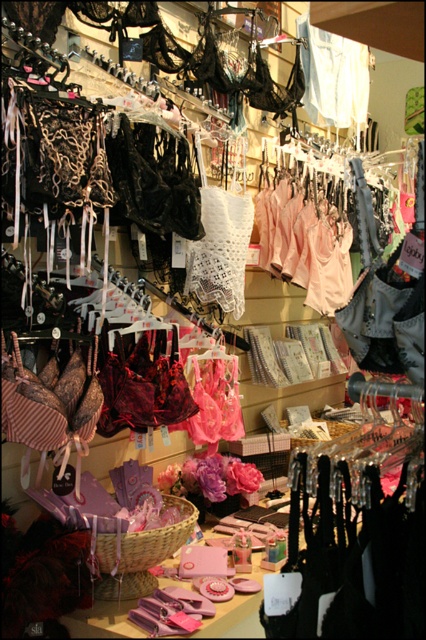
Does light beige lace lingerie at center come in front of brown woven basket at center?

That is False.

Is point (344, 61) positioned after point (117, 561)?

Yes, it is behind point (117, 561).

I want to click on light beige lace lingerie at center, so tap(333, 76).